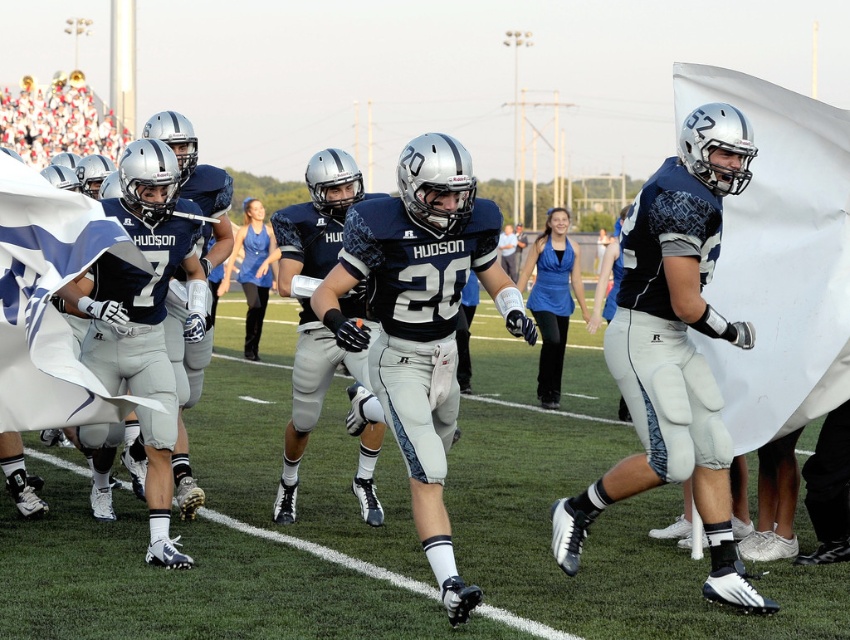
You are a player on the field during the game. You notice two points marked on the field. The first point is at coordinates point [806,152] and the second point is at point [17,193]. If you are standing at the second point, which direction should you move to reach the first point?

To reach the first point from the second point, you should move upwards because point [806,152] is behind point [17,193], meaning it is located in the upward direction relative to your current position.

You are a photographer standing at the center of the field. You want to capture a photo of the white fabric flag at right. Where should you point your camera to include it in the frame?

The white fabric flag at right is located at point (779, 257), so you should point your camera towards that coordinate to capture it.